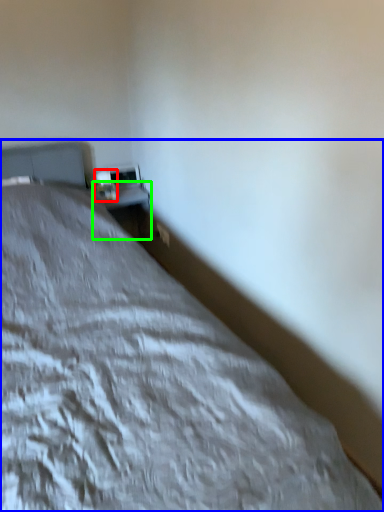
Question: Considering the real-world distances, which object is closest to table lamp (highlighted by a red box)? bed (highlighted by a blue box) or table (highlighted by a green box).

Choices:
 (A) bed
 (B) table

Answer: (B)